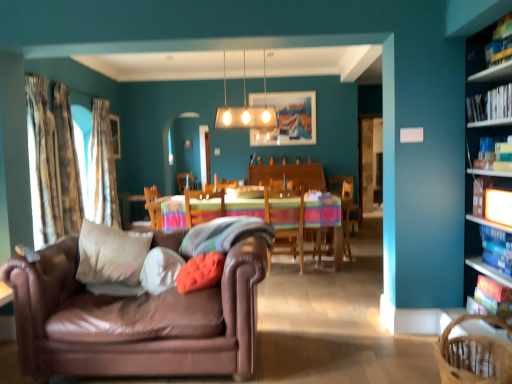
Question: Is hardcover book at upper right, arranged as the 2th book when viewed from the top, in front of or behind hardcover book at upper right, acting as the 3th book starting from the bottom, in the image?

Choices:
 (A) front
 (B) behind

Answer: (A)

Question: From the image's perspective, is hardcover book at upper right, the 4th book ordered from the bottom, located above or below hardcover book at upper right, placed as the third book when sorted from top to bottom?

Choices:
 (A) above
 (B) below

Answer: (A)

Question: Considering the real-world distances, which object is closest to the white soft pillow at center, positioned as the third pillow in right-to-left order?

Choices:
 (A) brown woven basket at lower right
 (B) hardcover book at upper right, which ranks as the first book in top-to-bottom order
 (C) wooden chair at center, positioned as the 2th chair in right-to-left order
 (D) velvety orange pillow at center, positioned as the first pillow in right-to-left order
 (E) white soft cushion at center, the fourth pillow when ordered from right to left

Answer: (E)

Question: Which of these objects is positioned closest to the wooden table with striped cloth at center?

Choices:
 (A) patterned fabric curtain at left, which is the 1th curtain from back to front
 (B) white glossy rectangular light fixture at upper center
 (C) orange fabric pillow at center, marked as the second pillow in a right-to-left arrangement
 (D) leather couch at left
 (E) hardcover book at right, acting as the 4th book starting from the top

Answer: (B)